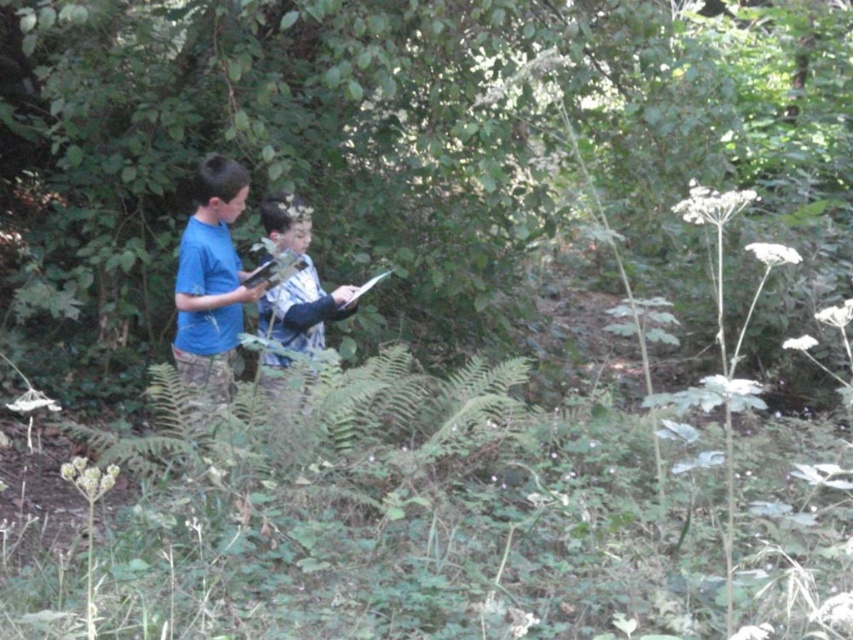
Question: Is the position of blue matte shirt at center more distant than that of blue fabric shirt at center?

Choices:
 (A) yes
 (B) no

Answer: (A)

Question: Which point is farther to the camera?

Choices:
 (A) (184, 276)
 (B) (273, 316)

Answer: (B)

Question: Is blue matte shirt at center to the right of blue fabric shirt at center from the viewer's perspective?

Choices:
 (A) yes
 (B) no

Answer: (B)

Question: Which of the following is the farthest from the observer?

Choices:
 (A) blue fabric shirt at center
 (B) blue matte shirt at center

Answer: (B)

Question: Is blue matte shirt at center smaller than blue fabric shirt at center?

Choices:
 (A) yes
 (B) no

Answer: (A)